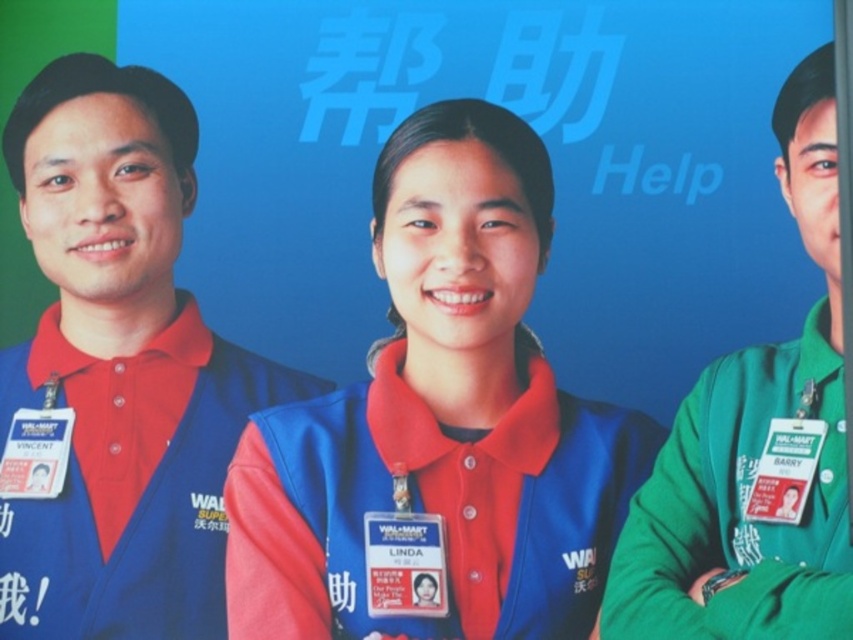
Does point (398, 595) come closer to viewer compared to point (758, 502)?

No, (398, 595) is behind (758, 502).

Is matte plastic badge at center thinner than white plastic badge at right?

No, matte plastic badge at center is not thinner than white plastic badge at right.

Is point (413, 518) positioned before point (772, 428)?

No, (413, 518) is behind (772, 428).

Locate an element on the screen. The width and height of the screenshot is (853, 640). matte plastic badge at center is located at coordinates (405, 563).

Is point (387, 529) positioned after point (48, 496)?

No, (387, 529) is in front of (48, 496).

Does matte plastic badge at center have a lesser width compared to white plastic badge at left?

Incorrect, matte plastic badge at center's width is not less than white plastic badge at left's.

At what (x,y) coordinates should I click in order to perform the action: click on matte plastic badge at center. Please return your answer as a coordinate pair (x, y). This screenshot has width=853, height=640. Looking at the image, I should click on (405, 563).

I want to click on matte plastic badge at center, so click(405, 563).

Can you confirm if blue fabric vest at center is smaller than white plastic badge at left?

Actually, blue fabric vest at center might be larger than white plastic badge at left.

Image resolution: width=853 pixels, height=640 pixels. Identify the location of blue fabric vest at center. (431, 509).